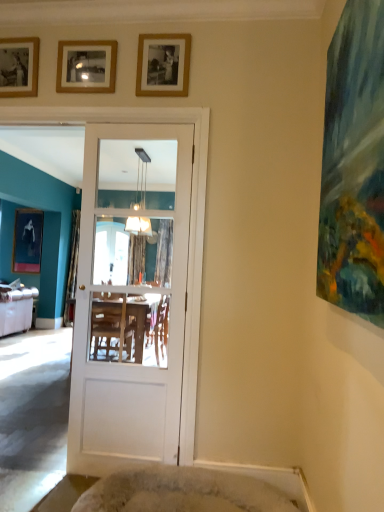
Question: Does gold-framed photo at upper center, the fourth picture frame in the back-to-front sequence, have a greater height compared to white glossy door at center?

Choices:
 (A) yes
 (B) no

Answer: (B)

Question: From a real-world perspective, is gold-framed photo at upper center, arranged as the 1th picture frame when viewed from the right, below white glossy door at center?

Choices:
 (A) yes
 (B) no

Answer: (B)

Question: Does gold-framed photo at upper center, the fourth picture frame when ordered from left to right, appear on the right side of white glossy door at center?

Choices:
 (A) no
 (B) yes

Answer: (B)

Question: Is gold-framed photo at upper center, the first picture frame positioned from the front, bigger than white glossy door at center?

Choices:
 (A) yes
 (B) no

Answer: (B)

Question: Is gold-framed photo at upper center, arranged as the 1th picture frame when viewed from the right, located outside white glossy door at center?

Choices:
 (A) no
 (B) yes

Answer: (B)

Question: Considering the positions of wooden photo frame at upper left, arranged as the third picture frame when viewed from the right, and matte black portrait at left, the 1th picture frame in the left-to-right sequence, in the image, is wooden photo frame at upper left, arranged as the third picture frame when viewed from the right, taller or shorter than matte black portrait at left, the 1th picture frame in the left-to-right sequence,?

Choices:
 (A) short
 (B) tall

Answer: (A)

Question: From a real-world perspective, is wooden photo frame at upper left, the 3th picture frame from the front, above or below matte black portrait at left, the 1th picture frame in the left-to-right sequence?

Choices:
 (A) above
 (B) below

Answer: (A)

Question: Which is correct: wooden photo frame at upper left, the 3th picture frame from the front, is inside matte black portrait at left, the 1th picture frame in the left-to-right sequence, or outside of it?

Choices:
 (A) inside
 (B) outside

Answer: (B)

Question: Visually, is wooden photo frame at upper left, arranged as the third picture frame when viewed from the right, positioned to the left or to the right of matte black portrait at left, which is the first picture frame in back-to-front order?

Choices:
 (A) left
 (B) right

Answer: (B)

Question: From a real-world perspective, is silver metallic studio couch at left physically located above or below white glossy door at center?

Choices:
 (A) above
 (B) below

Answer: (B)

Question: In terms of size, does silver metallic studio couch at left appear bigger or smaller than white glossy door at center?

Choices:
 (A) big
 (B) small

Answer: (A)

Question: In the image, is silver metallic studio couch at left on the left side or the right side of white glossy door at center?

Choices:
 (A) left
 (B) right

Answer: (A)

Question: Would you say silver metallic studio couch at left is inside or outside white glossy door at center?

Choices:
 (A) outside
 (B) inside

Answer: (A)

Question: Is wooden photo frame at upper left, the 2th picture frame in the back-to-front sequence, inside or outside of wooden picture frame at upper center, the third picture frame when ordered from left to right?

Choices:
 (A) outside
 (B) inside

Answer: (A)

Question: From a real-world perspective, is wooden photo frame at upper left, the 2th picture frame in the back-to-front sequence, physically located above or below wooden picture frame at upper center, acting as the third picture frame starting from the back?

Choices:
 (A) above
 (B) below

Answer: (A)